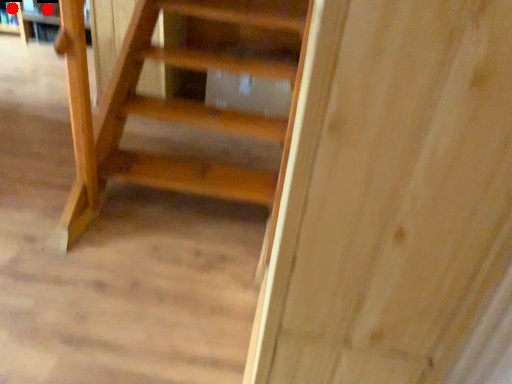
Question: Two points are circled on the image, labeled by A and B beside each circle. Which point is closer to the camera?

Choices:
 (A) A is closer
 (B) B is closer

Answer: (A)